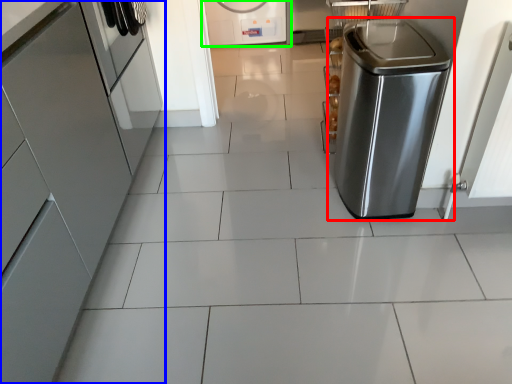
Question: Which object is the farthest from home appliance (highlighted by a red box)? Choose among these: home appliance (highlighted by a blue box) or home appliance (highlighted by a green box).

Choices:
 (A) home appliance
 (B) home appliance

Answer: (B)